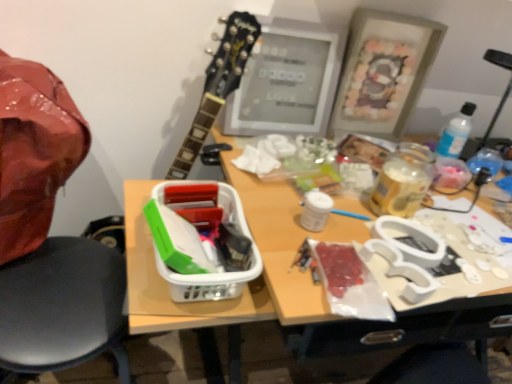
Question: Considering the relative sizes of white plastic lunch box at center and wooden picture frame at upper right in the image provided, is white plastic lunch box at center thinner than wooden picture frame at upper right?

Choices:
 (A) no
 (B) yes

Answer: (A)

Question: Is white plastic lunch box at center outside wooden picture frame at upper right?

Choices:
 (A) yes
 (B) no

Answer: (A)

Question: From the image's perspective, is white plastic lunch box at center located above wooden picture frame at upper right?

Choices:
 (A) no
 (B) yes

Answer: (A)

Question: Can you confirm if white plastic lunch box at center is wider than wooden picture frame at upper right?

Choices:
 (A) yes
 (B) no

Answer: (A)

Question: Is white plastic lunch box at center to the left of wooden picture frame at upper right from the viewer's perspective?

Choices:
 (A) yes
 (B) no

Answer: (A)

Question: Is white plastic lunch box at center at the right side of wooden picture frame at upper right?

Choices:
 (A) no
 (B) yes

Answer: (A)

Question: Can you confirm if matte gray frame at upper center is smaller than black plastic chair at left?

Choices:
 (A) no
 (B) yes

Answer: (B)

Question: Considering the relative sizes of matte gray frame at upper center and black plastic chair at left in the image provided, is matte gray frame at upper center wider than black plastic chair at left?

Choices:
 (A) no
 (B) yes

Answer: (A)

Question: From a real-world perspective, is matte gray frame at upper center located higher than black plastic chair at left?

Choices:
 (A) no
 (B) yes

Answer: (B)

Question: Is matte gray frame at upper center facing towards black plastic chair at left?

Choices:
 (A) yes
 (B) no

Answer: (B)

Question: Is matte gray frame at upper center in front of black plastic chair at left?

Choices:
 (A) yes
 (B) no

Answer: (B)

Question: Does matte gray frame at upper center appear on the left side of black plastic chair at left?

Choices:
 (A) no
 (B) yes

Answer: (A)

Question: Is black plastic chair at left in contact with matte gray frame at upper center?

Choices:
 (A) no
 (B) yes

Answer: (A)